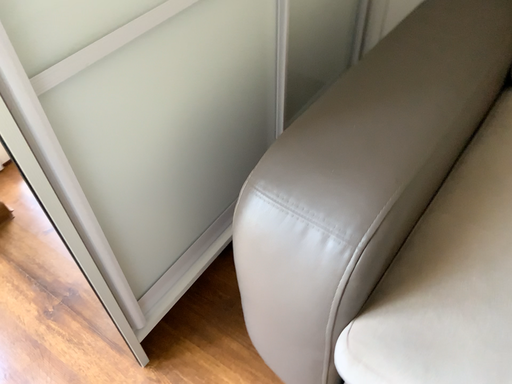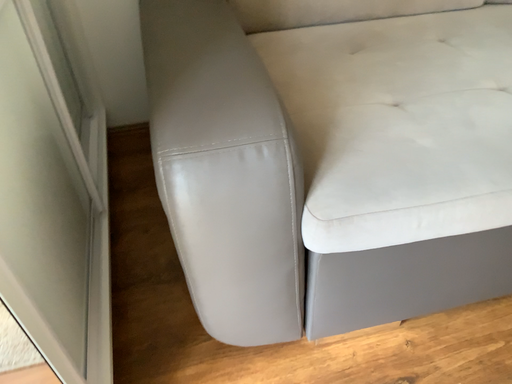
Question: How did the camera likely rotate when shooting the video?

Choices:
 (A) rotated left
 (B) rotated right

Answer: (B)